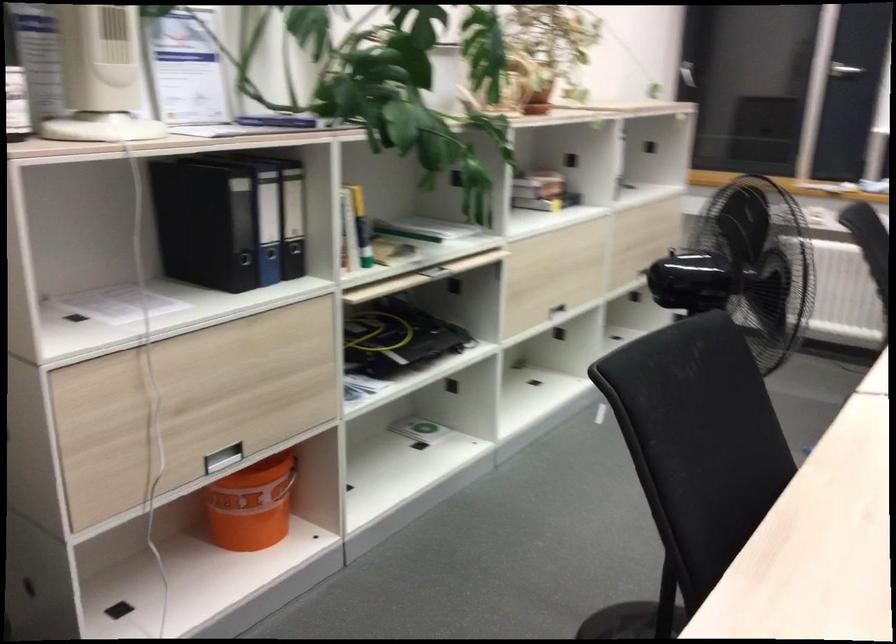
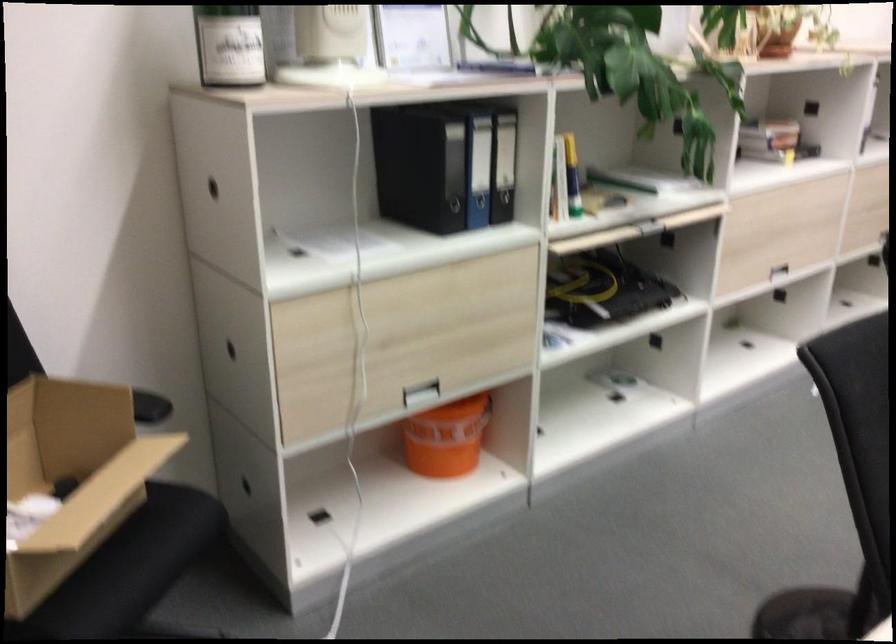
Where in the second image is the point corresponding to the point at 222,458 from the first image?

(419, 393)